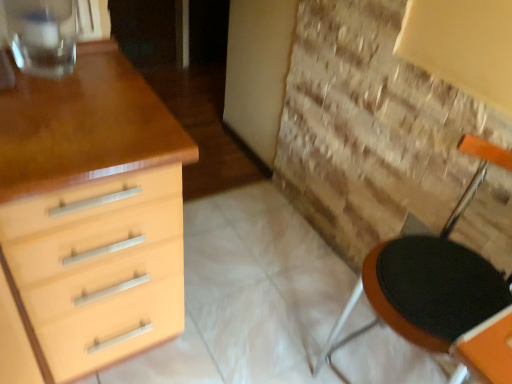
Question: In terms of size, does matte wood chest of drawers at left appear bigger or smaller than black fabric armchair at right?

Choices:
 (A) big
 (B) small

Answer: (A)

Question: Visually, is matte wood chest of drawers at left positioned to the left or to the right of black fabric armchair at right?

Choices:
 (A) left
 (B) right

Answer: (A)

Question: Estimate the real-world distances between objects in this image. Which object is closer to the black fabric armchair at right?

Choices:
 (A) matte wood chest of drawers at left
 (B) transparent glass at upper left

Answer: (A)

Question: Considering the real-world distances, which object is farthest from the matte wood chest of drawers at left?

Choices:
 (A) transparent glass at upper left
 (B) black fabric armchair at right

Answer: (B)